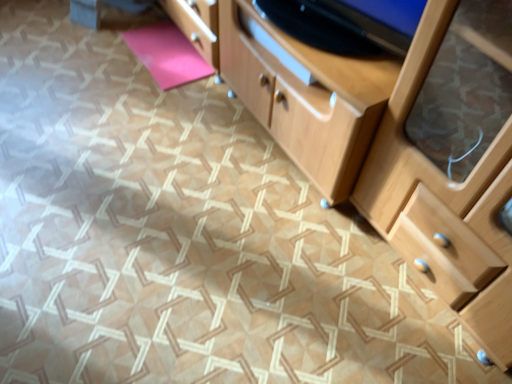
Question: Considering the positions of light wood chest of drawers at center and pink matte yoga mat at upper left in the image, is light wood chest of drawers at center taller or shorter than pink matte yoga mat at upper left?

Choices:
 (A) tall
 (B) short

Answer: (A)

Question: Would you say light wood chest of drawers at center is to the left or to the right of pink matte yoga mat at upper left in the picture?

Choices:
 (A) left
 (B) right

Answer: (B)

Question: Which is correct: light wood chest of drawers at center is inside pink matte yoga mat at upper left, or outside of it?

Choices:
 (A) outside
 (B) inside

Answer: (A)

Question: Considering their positions, is pink matte yoga mat at upper left located in front of or behind light wood chest of drawers at center?

Choices:
 (A) behind
 (B) front

Answer: (A)

Question: Is pink matte yoga mat at upper left to the left or to the right of light wood chest of drawers at center in the image?

Choices:
 (A) left
 (B) right

Answer: (A)

Question: Looking at their shapes, would you say pink matte yoga mat at upper left is wider or thinner than light wood chest of drawers at center?

Choices:
 (A) wide
 (B) thin

Answer: (B)

Question: Considering the positions of pink matte yoga mat at upper left and light wood chest of drawers at center in the image, is pink matte yoga mat at upper left bigger or smaller than light wood chest of drawers at center?

Choices:
 (A) big
 (B) small

Answer: (B)